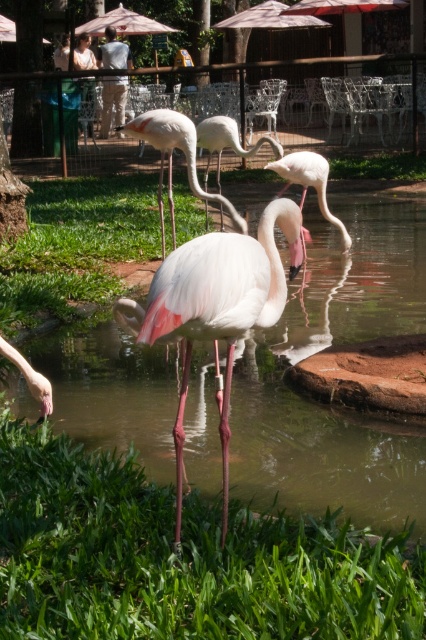
Is point (270, 218) behind point (218, 172)?

No, it is in front of (218, 172).

Is matte pink flamingo at center shorter than pink feathered flamingo at center?

Yes.

Find the location of `matte pink flamingo at center`. matte pink flamingo at center is located at coordinates (221, 307).

Which is above, matte pink flamingo at center or white matte flamingo at center?

white matte flamingo at center

Which of these two, matte pink flamingo at center or white matte flamingo at center, stands taller?

Standing taller between the two is matte pink flamingo at center.

Where is `matte pink flamingo at center`? matte pink flamingo at center is located at coordinates (221, 307).

Who is taller, white matte flamingo at center or pink feathered flamingo at center?

With more height is pink feathered flamingo at center.

Is point (235, 218) closer to viewer compared to point (216, 115)?

Yes, point (235, 218) is closer to viewer.

At what (x,y) coordinates should I click in order to perform the action: click on white matte flamingo at center. Please return your answer as a coordinate pair (x, y). Looking at the image, I should click on (170, 157).